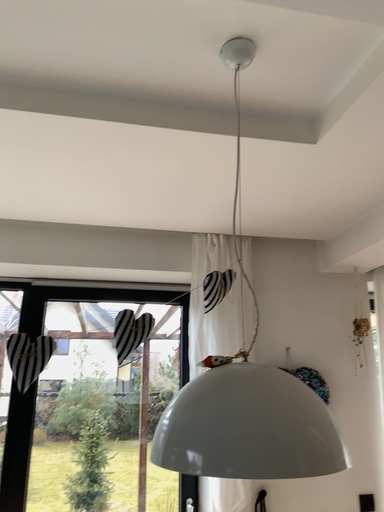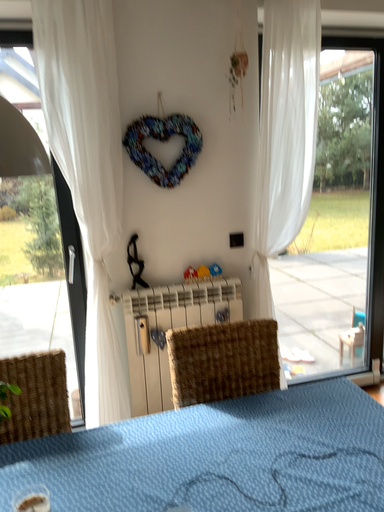
Question: How did the camera likely rotate when shooting the video?

Choices:
 (A) rotated upward
 (B) rotated downward

Answer: (B)